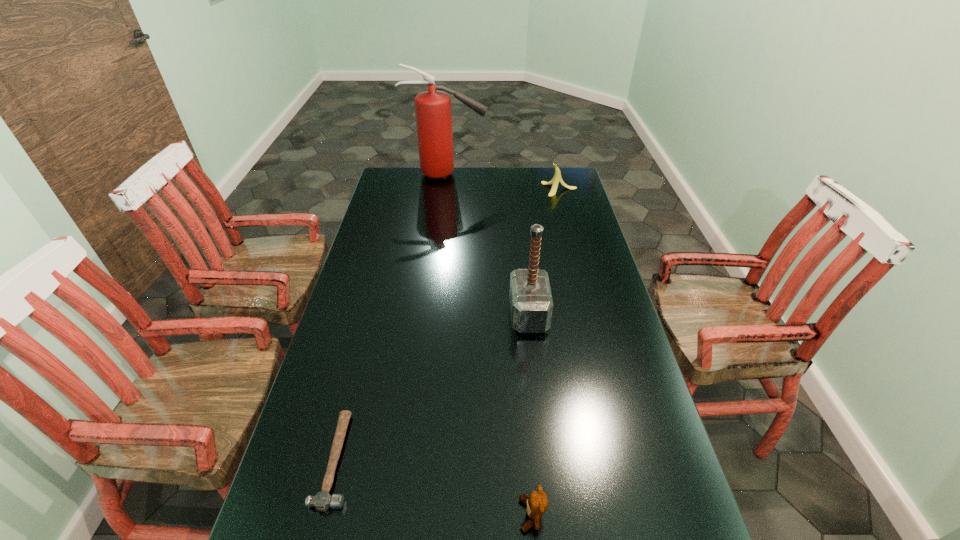
Where is `object that is at the far left corner`? object that is at the far left corner is located at coordinates (433, 111).

At what (x,y) coordinates should I click in order to perform the action: click on object situated at the far right corner. Please return your answer as a coordinate pair (x, y). The image size is (960, 540). Looking at the image, I should click on (557, 178).

Locate an element on the screen. vacant region at the far edge of the desktop is located at coordinates (517, 183).

You are a GUI agent. You are given a task and a screenshot of the screen. Output one action in this format:
    pyautogui.click(x=<x>, y=<y>)
    Task: Click on the free space at the left edge of the desktop
    
    Given the screenshot: What is the action you would take?
    pyautogui.click(x=334, y=344)

At what (x,y) coordinates should I click in order to perform the action: click on vacant space at the right edge of the desktop. Please return your answer as a coordinate pair (x, y). This screenshot has height=540, width=960. Looking at the image, I should click on (552, 214).

The image size is (960, 540). Find the location of `free point between the shorter hammer and the fourth tallest object`. free point between the shorter hammer and the fourth tallest object is located at coordinates (434, 487).

Locate an element on the screen. The height and width of the screenshot is (540, 960). empty location between the right hammer and the nearer hammer is located at coordinates (433, 387).

Locate an element on the screen. The width and height of the screenshot is (960, 540). vacant space in between the teddy bear and the left hammer is located at coordinates (434, 487).

This screenshot has height=540, width=960. I want to click on vacant region between the right hammer and the rightmost object, so click(544, 252).

Find the location of a particular element. This screenshot has height=540, width=960. free spot between the nearer hammer and the banana is located at coordinates (448, 325).